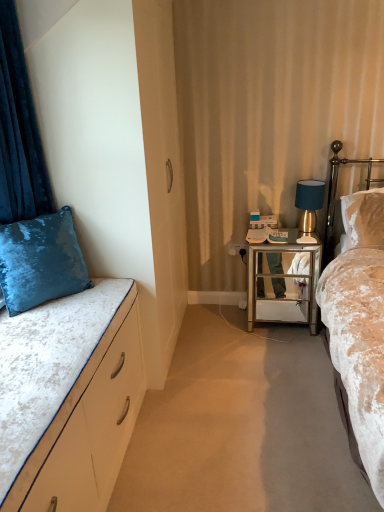
Locate an element on the screen. Image resolution: width=384 pixels, height=512 pixels. vacant space in front of gold mirrored nightstand at right is located at coordinates (280, 347).